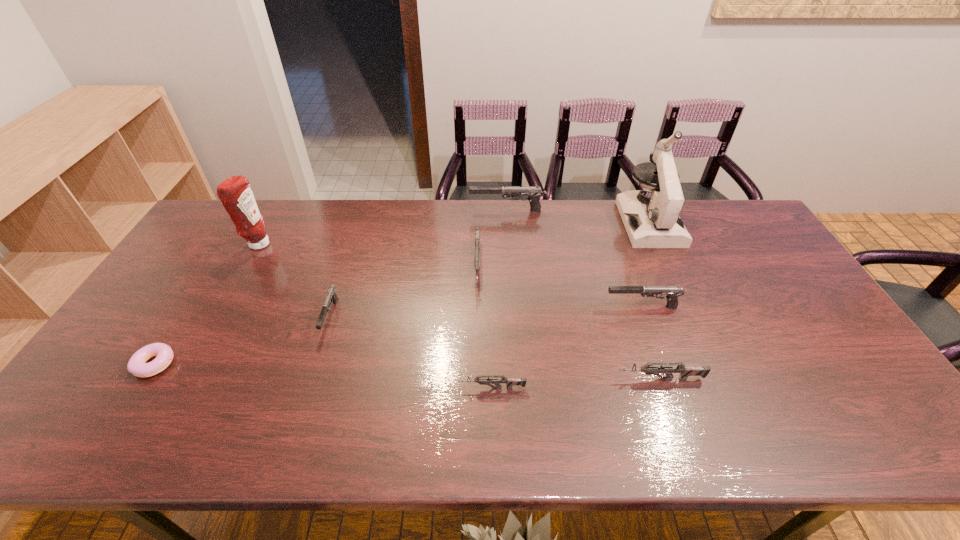
This screenshot has height=540, width=960. I want to click on microscope, so click(651, 218).

At what (x,y) coordinates should I click in order to perform the action: click on the eighth shortest object. Please return your answer as a coordinate pair (x, y). The image size is (960, 540). Looking at the image, I should click on (235, 193).

Where is `condiment`? The height and width of the screenshot is (540, 960). condiment is located at coordinates click(x=235, y=193).

Where is `the biggest gray gun`? This screenshot has width=960, height=540. the biggest gray gun is located at coordinates (533, 193).

The height and width of the screenshot is (540, 960). Find the location of `the seventh shortest object`. the seventh shortest object is located at coordinates (533, 193).

You are a GUI agent. You are given a task and a screenshot of the screen. Output one action in this format:
    pyautogui.click(x=<x>, y=<y>)
    Task: Click on the farthest grey gun
    Image resolution: width=960 pixels, height=540 pixels.
    Given the screenshot: What is the action you would take?
    pyautogui.click(x=477, y=229)

Find the location of a particular element. This screenshot has height=540, width=960. the rightmost gray gun is located at coordinates (673, 292).

Find the location of a particular element. This screenshot has height=540, width=960. the second biggest grey gun is located at coordinates (685, 371).

Locate an element on the screen. The height and width of the screenshot is (540, 960). the rightmost grey gun is located at coordinates (685, 371).

Identify the location of the smallest gray gun. This screenshot has width=960, height=540. (331, 296).